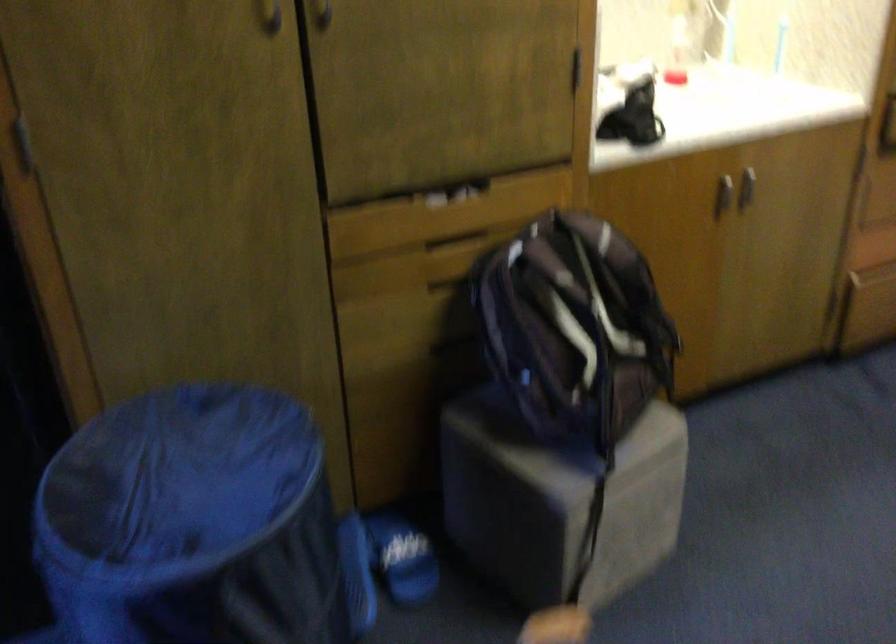
Locate an element on the screen. The image size is (896, 644). blue slide sandal is located at coordinates (401, 558).